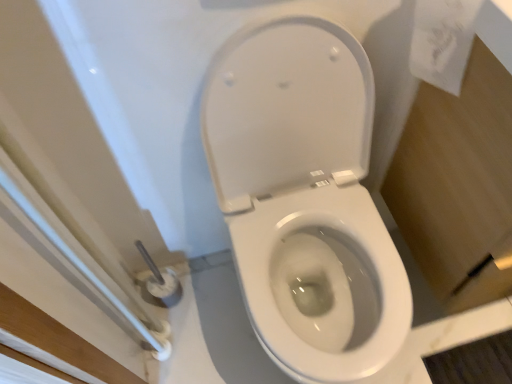
Question: From a real-world perspective, does white paper towel at upper right sit lower than white glossy toilet at center?

Choices:
 (A) yes
 (B) no

Answer: (B)

Question: Can you confirm if white paper towel at upper right is shorter than white glossy toilet at center?

Choices:
 (A) no
 (B) yes

Answer: (B)

Question: Are white paper towel at upper right and white glossy toilet at center far apart?

Choices:
 (A) yes
 (B) no

Answer: (B)

Question: Is white paper towel at upper right looking in the opposite direction of white glossy toilet at center?

Choices:
 (A) yes
 (B) no

Answer: (B)

Question: From a real-world perspective, is white paper towel at upper right located higher than white glossy toilet at center?

Choices:
 (A) no
 (B) yes

Answer: (B)

Question: From the image's perspective, is white paper towel at upper right located beneath white glossy toilet at center?

Choices:
 (A) no
 (B) yes

Answer: (A)

Question: Is white glossy toilet at center behind white paper towel at upper right?

Choices:
 (A) yes
 (B) no

Answer: (B)

Question: Is white glossy toilet at center at the left side of white paper towel at upper right?

Choices:
 (A) yes
 (B) no

Answer: (A)

Question: Can you confirm if white glossy toilet at center is shorter than white paper towel at upper right?

Choices:
 (A) yes
 (B) no

Answer: (B)

Question: Considering the relative sizes of white glossy toilet at center and white paper towel at upper right in the image provided, is white glossy toilet at center thinner than white paper towel at upper right?

Choices:
 (A) yes
 (B) no

Answer: (B)

Question: From the image's perspective, is white glossy toilet at center on white paper towel at upper right?

Choices:
 (A) yes
 (B) no

Answer: (B)

Question: Is white glossy toilet at center wider than white paper towel at upper right?

Choices:
 (A) no
 (B) yes

Answer: (B)

Question: Is white paper towel at upper right in front of or behind white glossy toilet at center in the image?

Choices:
 (A) behind
 (B) front

Answer: (A)